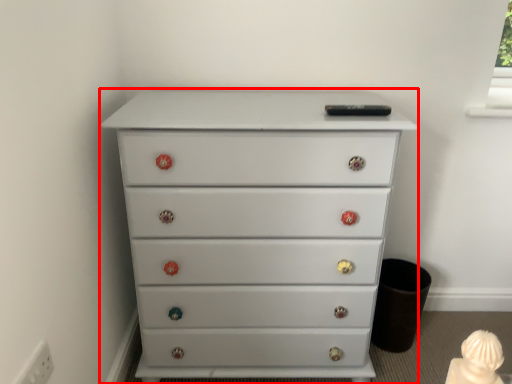
Question: Considering the relative positions of chest of drawers (annotated by the red box) and electric outlet in the image provided, where is chest of drawers (annotated by the red box) located with respect to the staircase?

Choices:
 (A) right
 (B) left

Answer: (A)